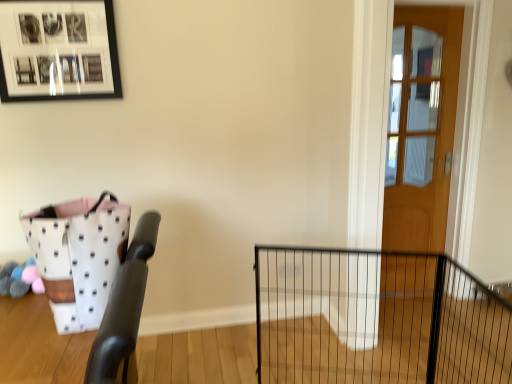
Describe the element at coordinates (78, 256) in the screenshot. I see `white dotted fabric basket at left` at that location.

Find the location of a particular element. black matte picture frame at upper left is located at coordinates (58, 50).

What is the approximate height of black wire fence at center?

It is 31.63 inches.

Identify the location of white dotted fabric basket at left. (78, 256).

Does point (403, 176) appear closer or farther from the camera than point (378, 375)?

Clearly, point (403, 176) is more distant from the camera than point (378, 375).

Would you consider wooden door at right to be distant from black wire fence at center?

No.

Is wooden door at right spatially inside black wire fence at center, or outside of it?

wooden door at right lies outside black wire fence at center.

Based on the photo, in the image, is white dotted fabric basket at left positioned in front of or behind wooden door at right?

Clearly, white dotted fabric basket at left is in front of wooden door at right.

From a real-world perspective, which is physically below, white dotted fabric basket at left or wooden door at right?

In real-world perspective, wooden door at right is lower.

The width and height of the screenshot is (512, 384). What are the coordinates of `door that is under the white dotted fabric basket at left (from a real-world perspective)` in the screenshot? It's located at (421, 126).

Between point (395, 379) and point (1, 1), which one is positioned behind?

Point (395, 379)

Is black wire fence at center placed right next to black matte picture frame at upper left?

black wire fence at center and black matte picture frame at upper left are clearly separated.

Is black wire fence at center at the right side of black matte picture frame at upper left?

Yes.

Based on the photo, which object is more forward, black wire fence at center or black matte picture frame at upper left?

black wire fence at center is more forward.

Is black wire fence at center smaller than wooden door at right?

Incorrect, black wire fence at center is not smaller in size than wooden door at right.

Considering the positions of objects black wire fence at center and wooden door at right in the image provided, who is more to the left, black wire fence at center or wooden door at right?

From the viewer's perspective, black wire fence at center appears more on the left side.

Which is behind, black wire fence at center or wooden door at right?

wooden door at right is more distant.

Measure the distance from white dotted fabric basket at left to black matte picture frame at upper left.

39.26 inches.

Is the position of white dotted fabric basket at left more distant than that of black matte picture frame at upper left?

No, white dotted fabric basket at left is in front of black matte picture frame at upper left.

Does white dotted fabric basket at left appear on the left side of black matte picture frame at upper left?

No, white dotted fabric basket at left is not to the left of black matte picture frame at upper left.

Is white dotted fabric basket at left inside the boundaries of black matte picture frame at upper left, or outside?

white dotted fabric basket at left is not enclosed by black matte picture frame at upper left.

The width and height of the screenshot is (512, 384). I want to click on door below the black matte picture frame at upper left (from a real-world perspective), so click(421, 126).

Considering the positions of objects black matte picture frame at upper left and wooden door at right in the image provided, who is more to the right, black matte picture frame at upper left or wooden door at right?

Positioned to the right is wooden door at right.

Is black matte picture frame at upper left turned away from wooden door at right?

No, black matte picture frame at upper left is not facing away from wooden door at right.

Between wooden door at right and white dotted fabric basket at left, which one is positioned in front?

Positioned in front is white dotted fabric basket at left.

Considering the positions of objects wooden door at right and white dotted fabric basket at left in the image provided, who is more to the right, wooden door at right or white dotted fabric basket at left?

Positioned to the right is wooden door at right.

Considering the relative sizes of wooden door at right and white dotted fabric basket at left in the image provided, is wooden door at right wider than white dotted fabric basket at left?

Incorrect, the width of wooden door at right does not surpass that of white dotted fabric basket at left.

Find the location of a particular element. door behind the black wire fence at center is located at coordinates (421, 126).

This screenshot has height=384, width=512. I want to click on door lying above the white dotted fabric basket at left (from the image's perspective), so click(421, 126).

When comparing their distances from white dotted fabric basket at left, does black wire fence at center or wooden door at right seem further?

The object further to white dotted fabric basket at left is wooden door at right.

Estimate the real-world distances between objects in this image. Which object is closer to black matte picture frame at upper left, white dotted fabric basket at left or black wire fence at center?

white dotted fabric basket at left is closer to black matte picture frame at upper left.

Considering their positions, is black matte picture frame at upper left positioned closer to white dotted fabric basket at left than black wire fence at center?

black matte picture frame at upper left.

Based on their spatial positions, is wooden door at right or black wire fence at center further from white dotted fabric basket at left?

wooden door at right is further to white dotted fabric basket at left.

Which object lies further to the anchor point wooden door at right, black matte picture frame at upper left or black wire fence at center?

black matte picture frame at upper left lies further to wooden door at right than the other object.

From the image, which object appears to be nearer to white dotted fabric basket at left, black matte picture frame at upper left or wooden door at right?

black matte picture frame at upper left.

Based on the photo, considering their positions, is wooden door at right positioned closer to white dotted fabric basket at left than black matte picture frame at upper left?

black matte picture frame at upper left lies closer to white dotted fabric basket at left than the other object.

Based on their spatial positions, is white dotted fabric basket at left or black matte picture frame at upper left further from wooden door at right?

white dotted fabric basket at left.

The width and height of the screenshot is (512, 384). I want to click on fence between black matte picture frame at upper left and wooden door at right from left to right, so click(x=376, y=319).

What are the coordinates of `basket between black matte picture frame at upper left and wooden door at right from left to right` in the screenshot? It's located at (78, 256).

The height and width of the screenshot is (384, 512). Find the location of `fence between white dotted fabric basket at left and wooden door at right in the horizontal direction`. fence between white dotted fabric basket at left and wooden door at right in the horizontal direction is located at coordinates (376, 319).

Locate an element on the screen. basket between black matte picture frame at upper left and black wire fence at center is located at coordinates (78, 256).